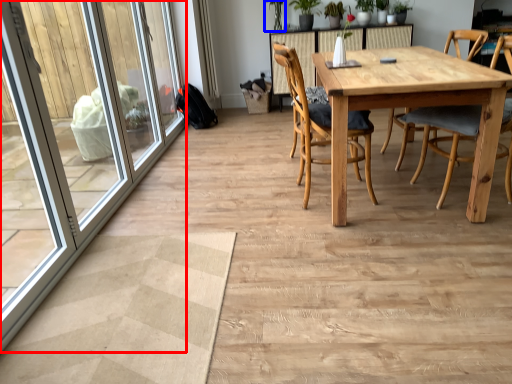
Question: Among these objects, which one is farthest to the camera, screen door (highlighted by a red box) or plant (highlighted by a blue box)?

Choices:
 (A) screen door
 (B) plant

Answer: (B)